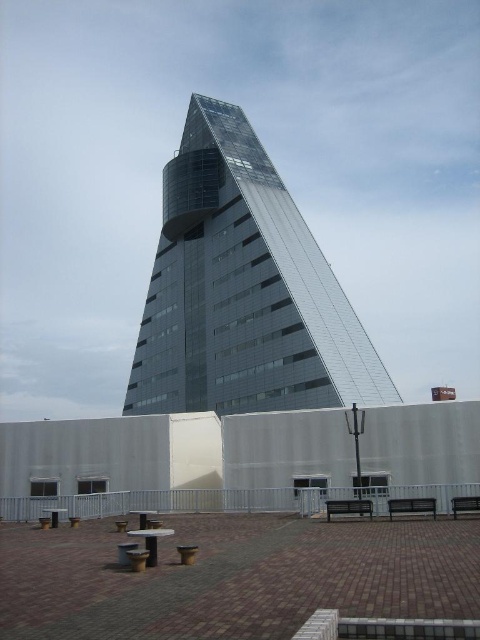
Consider the image. Can you confirm if transparent glass building at center is bigger than wooden park bench at center?

Yes, transparent glass building at center is bigger than wooden park bench at center.

What do you see at coordinates (242, 291) in the screenshot? I see `transparent glass building at center` at bounding box center [242, 291].

What are the coordinates of `transparent glass building at center` in the screenshot? It's located at (242, 291).

Who is taller, transparent glass building at center or black metal bench at lower right?

transparent glass building at center is taller.

Is transparent glass building at center to the left of black metal bench at lower right from the viewer's perspective?

Indeed, transparent glass building at center is positioned on the left side of black metal bench at lower right.

The height and width of the screenshot is (640, 480). Identify the location of transparent glass building at center. (242, 291).

Does transparent glass building at center appear under metallic silver bench at lower right?

No, transparent glass building at center is not below metallic silver bench at lower right.

Is point (205, 250) farther from camera compared to point (456, 508)?

Yes, point (205, 250) is farther from viewer.

Between point (273, 230) and point (456, 497), which one is positioned in front?

Positioned in front is point (456, 497).

Find the location of `transparent glass building at center`. transparent glass building at center is located at coordinates (242, 291).